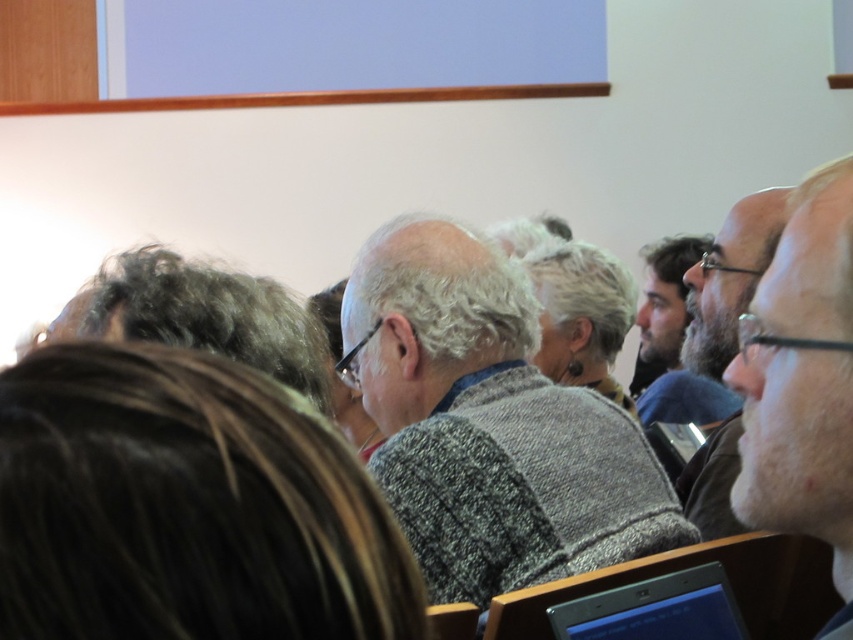
Question: Is gray speckled sweater at center bigger than gray wool sweater at center?

Choices:
 (A) no
 (B) yes

Answer: (A)

Question: Which object is the closest to the dark brown hair at center?

Choices:
 (A) silver metallic laptop at lower right
 (B) gray knitted sweater at center
 (C) gray wool sweater at center
 (D) gray speckled sweater at center

Answer: (B)

Question: Is dark brown hair at center positioned in front of dark brown beard at center?

Choices:
 (A) no
 (B) yes

Answer: (B)

Question: Can you confirm if gray knitted sweater at center is thinner than dark brown beard at center?

Choices:
 (A) no
 (B) yes

Answer: (A)

Question: Which object is the closest to the gray knitted sweater at center?

Choices:
 (A) dark brown beard at center
 (B) gray speckled sweater at center
 (C) dark brown hair at center

Answer: (C)

Question: Estimate the real-world distances between objects in this image. Which object is closer to the gray speckled sweater at center?

Choices:
 (A) dark brown beard at center
 (B) gray knitted sweater at center
 (C) gray wool sweater at center
 (D) silver metallic laptop at lower right

Answer: (D)